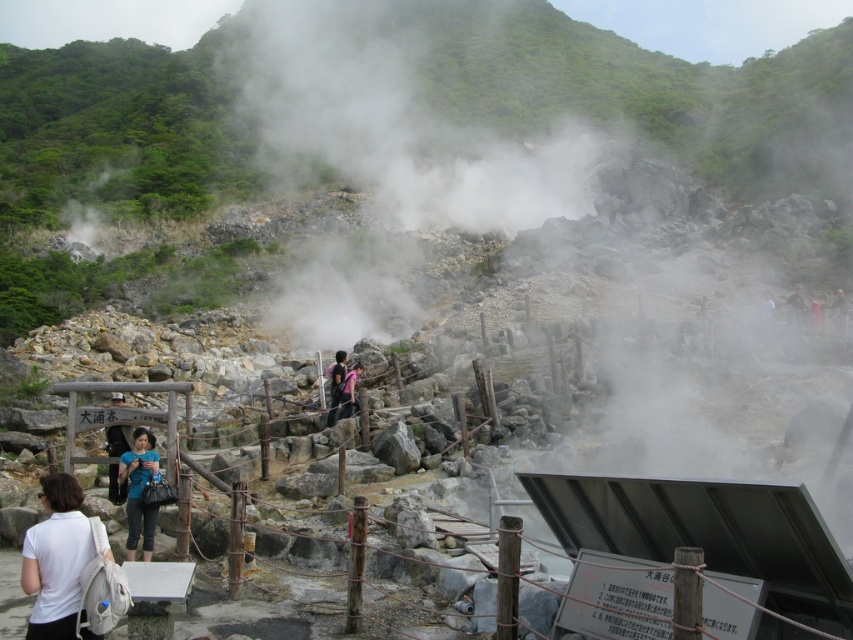
Question: Which point is closer to the camera?

Choices:
 (A) (339, 371)
 (B) (341, 406)

Answer: (B)

Question: Can you confirm if dark blue backpack at center is smaller than light brown wooden post at center?

Choices:
 (A) yes
 (B) no

Answer: (A)

Question: Based on their relative distances, which object is nearer to the dark blue shirt at center?

Choices:
 (A) dark green fabric jacket at upper right
 (B) red fabric person at center

Answer: (B)

Question: Estimate the real-world distances between objects in this image. Which object is closer to the light brown wooden post at center?

Choices:
 (A) red fabric person at center
 (B) dark blue shirt at center
 (C) white fabric backpack at lower left

Answer: (A)

Question: Can you confirm if matte black shirt at center is bigger than dark blue backpack at center?

Choices:
 (A) no
 (B) yes

Answer: (B)

Question: Does matte black shirt at center have a greater width compared to light brown wooden post at center?

Choices:
 (A) yes
 (B) no

Answer: (A)